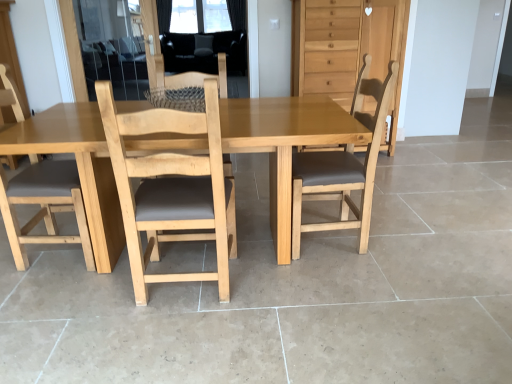
Question: Which direction should I rotate to face light brown wood chair at center, which ranks as the 1th chair in right-to-left order, — up or down?

Choices:
 (A) up
 (B) down

Answer: (A)

Question: Does light brown wooden dresser at upper right lie behind transparent glass screen door at upper left?

Choices:
 (A) no
 (B) yes

Answer: (A)

Question: Does light brown wooden dresser at upper right have a larger size compared to transparent glass screen door at upper left?

Choices:
 (A) no
 (B) yes

Answer: (B)

Question: Does light brown wooden dresser at upper right have a greater height compared to transparent glass screen door at upper left?

Choices:
 (A) no
 (B) yes

Answer: (B)

Question: Considering the relative sizes of light brown wooden dresser at upper right and transparent glass screen door at upper left in the image provided, is light brown wooden dresser at upper right thinner than transparent glass screen door at upper left?

Choices:
 (A) no
 (B) yes

Answer: (A)

Question: Is light brown wooden dresser at upper right at the right side of transparent glass screen door at upper left?

Choices:
 (A) no
 (B) yes

Answer: (B)

Question: Is light brown wooden dresser at upper right at the left side of transparent glass screen door at upper left?

Choices:
 (A) yes
 (B) no

Answer: (B)

Question: Is light wood chair at center, acting as the 2th chair starting from the right, looking in the opposite direction of light brown wooden dresser at upper right?

Choices:
 (A) yes
 (B) no

Answer: (B)

Question: Is light wood chair at center, which is counted as the third chair, starting from the left, positioned before light brown wooden dresser at upper right?

Choices:
 (A) no
 (B) yes

Answer: (B)

Question: From a real-world perspective, is light wood chair at center, which is counted as the third chair, starting from the left, positioned over light brown wooden dresser at upper right based on gravity?

Choices:
 (A) yes
 (B) no

Answer: (B)

Question: Is light wood chair at center, acting as the 2th chair starting from the right, outside light brown wooden dresser at upper right?

Choices:
 (A) no
 (B) yes

Answer: (B)

Question: Is light wood chair at center, which is counted as the third chair, starting from the left, taller than light brown wooden dresser at upper right?

Choices:
 (A) yes
 (B) no

Answer: (B)

Question: Is light wood chair at center, acting as the 2th chair starting from the right, shorter than light brown wooden dresser at upper right?

Choices:
 (A) yes
 (B) no

Answer: (A)

Question: From a real-world perspective, is light brown wood chair at left, positioned as the 2th chair in left-to-right order, on light brown wood chair at center, which is the 4th chair in left-to-right order?

Choices:
 (A) yes
 (B) no

Answer: (A)